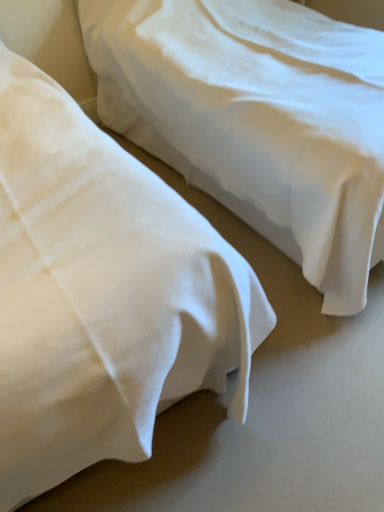
Question: In which direction should I rotate to look at white cotton bed at center, acting as the first bed starting from the left?

Choices:
 (A) left
 (B) right

Answer: (A)

Question: Is white cotton bed at center, which is the second bed from right to left, completely or partially inside white smooth bed at center, positioned as the 2th bed in left-to-right order?

Choices:
 (A) yes
 (B) no

Answer: (B)

Question: Is white cotton bed at center, which is the second bed from right to left, at the back of white smooth bed at center, positioned as the 2th bed in left-to-right order?

Choices:
 (A) no
 (B) yes

Answer: (A)

Question: Is white smooth bed at center, positioned as the 1th bed in right-to-left order, not inside white cotton bed at center, acting as the first bed starting from the left?

Choices:
 (A) yes
 (B) no

Answer: (A)

Question: Is white smooth bed at center, positioned as the 1th bed in right-to-left order, closer to camera compared to white cotton bed at center, which is the second bed from right to left?

Choices:
 (A) yes
 (B) no

Answer: (B)

Question: Can you confirm if white smooth bed at center, positioned as the 1th bed in right-to-left order, is smaller than white cotton bed at center, which is the second bed from right to left?

Choices:
 (A) yes
 (B) no

Answer: (B)

Question: Considering the relative sizes of white smooth bed at center, positioned as the 1th bed in right-to-left order, and white cotton bed at center, which is the second bed from right to left, in the image provided, is white smooth bed at center, positioned as the 1th bed in right-to-left order, bigger than white cotton bed at center, which is the second bed from right to left,?

Choices:
 (A) no
 (B) yes

Answer: (B)

Question: Is the position of white cotton bed at center, acting as the first bed starting from the left, more distant than that of white smooth bed at center, positioned as the 1th bed in right-to-left order?

Choices:
 (A) no
 (B) yes

Answer: (A)

Question: Can you confirm if white cotton bed at center, which is the second bed from right to left, is wider than white smooth bed at center, positioned as the 2th bed in left-to-right order?

Choices:
 (A) no
 (B) yes

Answer: (B)

Question: From a real-world perspective, is white cotton bed at center, which is the second bed from right to left, located beneath white smooth bed at center, positioned as the 1th bed in right-to-left order?

Choices:
 (A) no
 (B) yes

Answer: (A)

Question: From a real-world perspective, is white cotton bed at center, which is the second bed from right to left, located higher than white smooth bed at center, positioned as the 2th bed in left-to-right order?

Choices:
 (A) yes
 (B) no

Answer: (A)

Question: Is white cotton bed at center, which is the second bed from right to left, facing away from white smooth bed at center, positioned as the 2th bed in left-to-right order?

Choices:
 (A) yes
 (B) no

Answer: (B)

Question: Is white cotton bed at center, acting as the first bed starting from the left, taller than white smooth bed at center, positioned as the 2th bed in left-to-right order?

Choices:
 (A) no
 (B) yes

Answer: (B)

Question: From the image's perspective, relative to white cotton bed at center, acting as the first bed starting from the left, is white smooth bed at center, positioned as the 1th bed in right-to-left order, above or below?

Choices:
 (A) above
 (B) below

Answer: (A)